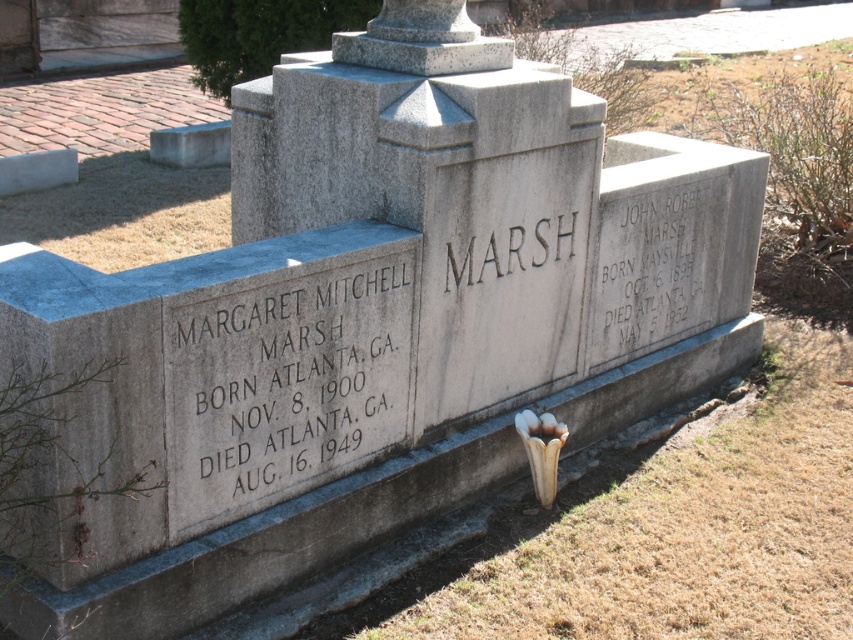
Does white stone plaque at center have a lesser width compared to black engraved text at center?

Incorrect, white stone plaque at center's width is not less than black engraved text at center's.

Is white stone plaque at center to the right of black engraved text at center from the viewer's perspective?

In fact, white stone plaque at center is to the left of black engraved text at center.

Describe the element at coordinates (283, 372) in the screenshot. Image resolution: width=853 pixels, height=640 pixels. I see `white stone plaque at center` at that location.

I want to click on white stone plaque at center, so click(283, 372).

Does white stone plaque at center appear on the left side of matte gray stone inscription at upper right?

Yes, white stone plaque at center is to the left of matte gray stone inscription at upper right.

Is point (352, 401) positioned in front of point (619, 234)?

Yes, it is.

Locate an element on the screen. The height and width of the screenshot is (640, 853). white stone plaque at center is located at coordinates point(283,372).

Does matte gray stone inscription at upper right appear over black engraved text at center?

Incorrect, matte gray stone inscription at upper right is not positioned above black engraved text at center.

From the picture: Is matte gray stone inscription at upper right positioned before black engraved text at center?

No, it is behind black engraved text at center.

Does point (595, 339) lie behind point (453, 269)?

Yes, point (595, 339) is behind point (453, 269).

The width and height of the screenshot is (853, 640). I want to click on matte gray stone inscription at upper right, so click(x=654, y=262).